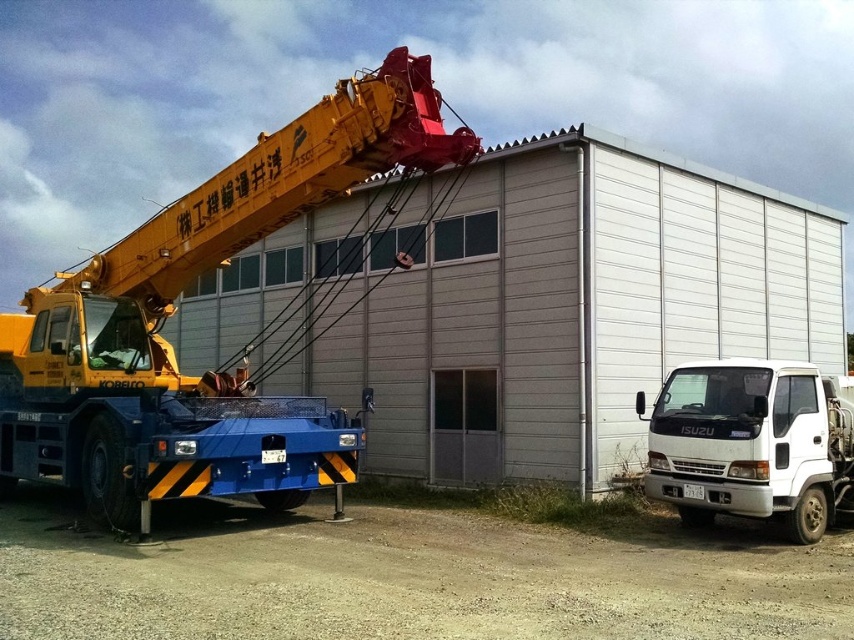
You are standing at the entrance of the industrial area and want to locate two specific points marked in the image. Which of the two points, point 1 at coordinates point (63,417) or point 2 at coordinates point (688,394), is closer to you?

Point 1 at coordinates point (63,417) is closer to you because it is further to the viewer than point 2 at coordinates point (688,394).

Consider the image. You are a delivery driver who needs to park your truck in the industrial area shown. The yellow metallic crane at left is blocking the entrance to the loading bay. Can you safely move the white matte truck at lower right to the side without hitting the crane?

The yellow metallic crane at left is located above the white matte truck at lower right, so moving the truck to the side would not interfere with the crane since the crane is positioned higher up.